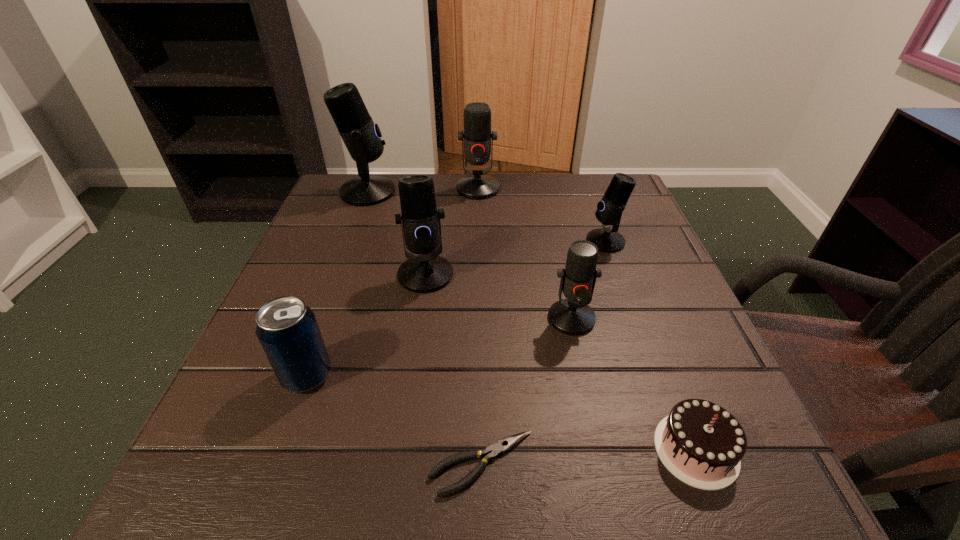
You are a GUI agent. You are given a task and a screenshot of the screen. Output one action in this format:
    pyautogui.click(x=<x>, y=<y>)
    Task: Click on the vacant space located on the right of the third nearest object
    The image size is (960, 540).
    Given the screenshot: What is the action you would take?
    pyautogui.click(x=375, y=376)

This screenshot has height=540, width=960. Identify the location of free region located on the left of the chocolate cake. (463, 450).

What are the coordinates of `vacant space situated on the back of the shortest object` in the screenshot? It's located at (481, 287).

At what (x,y) coordinates should I click in order to perform the action: click on chocolate cake located at the near edge. Please return your answer as a coordinate pair (x, y). The image size is (960, 540). Looking at the image, I should click on (702, 444).

Locate an element on the screen. pliers present at the near edge is located at coordinates (503, 445).

What are the coordinates of `microphone present at the left edge` in the screenshot? It's located at (361, 136).

Find the location of a particular element. soda can that is at the left edge is located at coordinates click(287, 329).

In order to click on microphone that is positioned at the right edge in this screenshot , I will do click(609, 210).

You are a GUI agent. You are given a task and a screenshot of the screen. Output one action in this format:
    pyautogui.click(x=<x>, y=<y>)
    Task: Click on the chocolate cake that is at the right edge
    The width and height of the screenshot is (960, 540).
    Given the screenshot: What is the action you would take?
    pyautogui.click(x=702, y=444)

In order to click on object at the far left corner in this screenshot , I will do `click(361, 136)`.